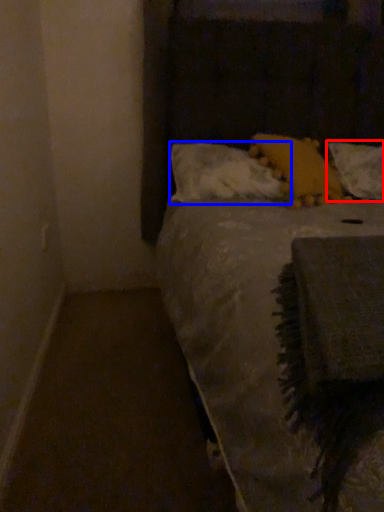
Question: Which of the following is the farthest to the observer, pillow (highlighted by a red box) or pillow (highlighted by a blue box)?

Choices:
 (A) pillow
 (B) pillow

Answer: (A)